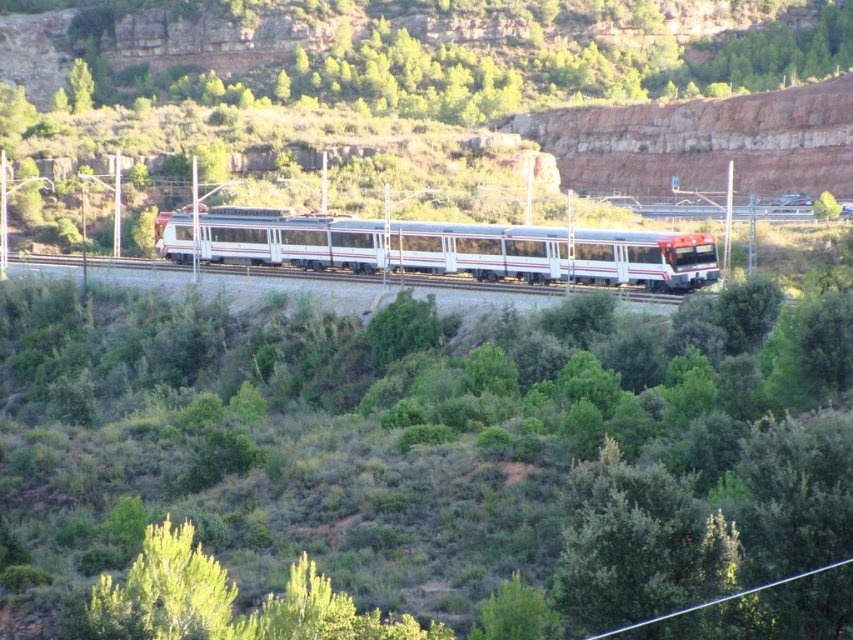
You are a passenger on the white glossy train at center. Looking out the window, you notice a green leafy shrub at center. Which one is bigger in size?

The green leafy shrub at center has a larger size compared to the white glossy train at center.

You are a passenger on the train and looking out the window. You notice a green leafy shrub at center. Can you determine its exact location using coordinates?

The green leafy shrub at center is located at coordinates point (434, 458).